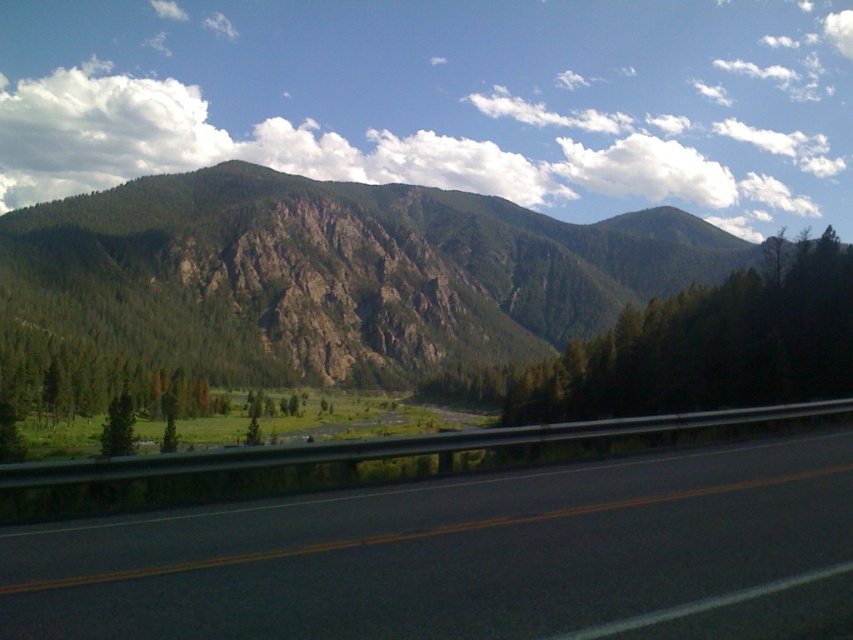
You are a hiker looking at the scene and want to know which object is taller between the green rocky mountain at upper left and the green matte tree at center. Can you determine this based on the scene?

The green rocky mountain at upper left is not as tall as the green matte tree at center, so the green matte tree at center is taller.

You are a hiker planning to take a photo of the green matte tree at center and the green matte tree at lower left. Which tree should you move closer to in order to capture both trees in the frame without zooming in?

You should move closer to the green matte tree at lower left because its smaller width allows you to fit both trees in the frame without zooming in.

You are standing at the highway railing and want to take a photo of the mountain range. There are two points marked on your map as potential vantage points. The first point is at coordinate point (648, 406) and the second is at point (126, 422). Which point would allow you to capture the mountain range without obstruction from the valley?

Point (648, 406) is behind point (126, 422), so the vantage point at point (648, 406) would be further back and less likely to have the valley obstructing the mountain view. Therefore, point (648, 406) is the better choice for an unobstructed view of the mountains.